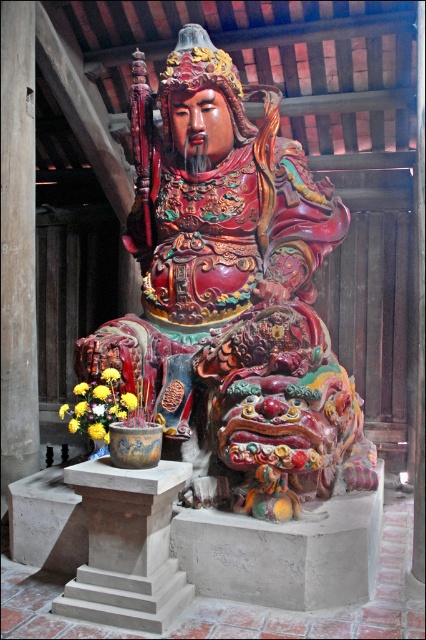
You are an art conservator assessing the placement of the glossy painted wood statue at center and the gray concrete pedestal at lower left. Based on their positions, which object is positioned higher in the image?

The glossy painted wood statue at center is located above the gray concrete pedestal at lower left, so it is positioned higher in the image.

You are an art conservator tasked with moving the glossy painted wood statue at center and the gray concrete pedestal at lower left to a new exhibition space. The doorway you need to pass through is 1.5 meters wide. Given their sizes, can both items fit through the doorway side by side without rotating them?

The glossy painted wood statue at center is wider than the gray concrete pedestal at lower left. Since the statue is wider, if both are placed side by side, their combined width would exceed the 1.5 meters doorway. Therefore, they cannot fit through the doorway side by side without rotating them.